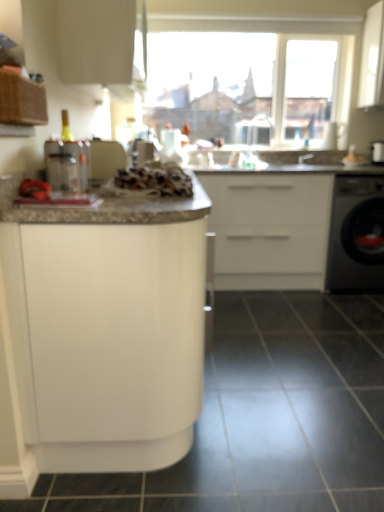
Question: Considering the positions of point (44, 426) and point (284, 428), is point (44, 426) closer or farther from the camera than point (284, 428)?

Choices:
 (A) closer
 (B) farther

Answer: (A)

Question: Is white glossy cabinet at center, which is counted as the 3th cabinetry, starting from the top, bigger or smaller than black glossy tile at lower center?

Choices:
 (A) small
 (B) big

Answer: (B)

Question: Estimate the real-world distances between objects in this image. Which object is farther from the clear plastic container at left?

Choices:
 (A) white matte cabinet at center, placed as the 2th cabinetry when sorted from bottom to top
 (B) black glossy dishwasher at right
 (C) white glossy cabinet at center, which is counted as the 3th cabinetry, starting from the top
 (D) white textured bread at center
 (E) transparent glass window at upper center

Answer: (E)

Question: Which object is the farthest from the clear plastic container at left?

Choices:
 (A) white glossy cabinet at center, which is counted as the 3th cabinetry, starting from the top
 (B) white matte cabinet at center, placed as the 2th cabinetry when sorted from top to bottom
 (C) white glossy cabinet at upper center, positioned as the third cabinetry in bottom-to-top order
 (D) clear plastic faucet at upper center, which ranks as the first faucet in left-to-right order
 (E) black glossy tile at lower center

Answer: (D)